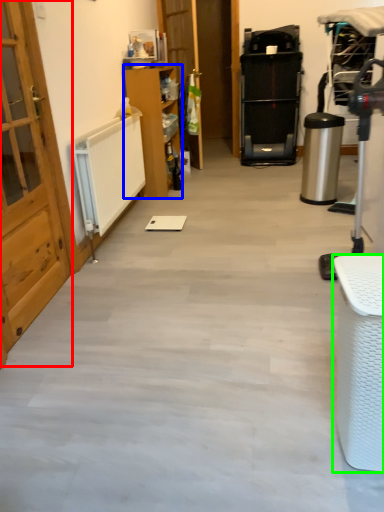
Question: Which object is positioned farthest from door (highlighted by a red box)? Select from furniture (highlighted by a blue box) and furniture (highlighted by a green box).

Choices:
 (A) furniture
 (B) furniture

Answer: (A)